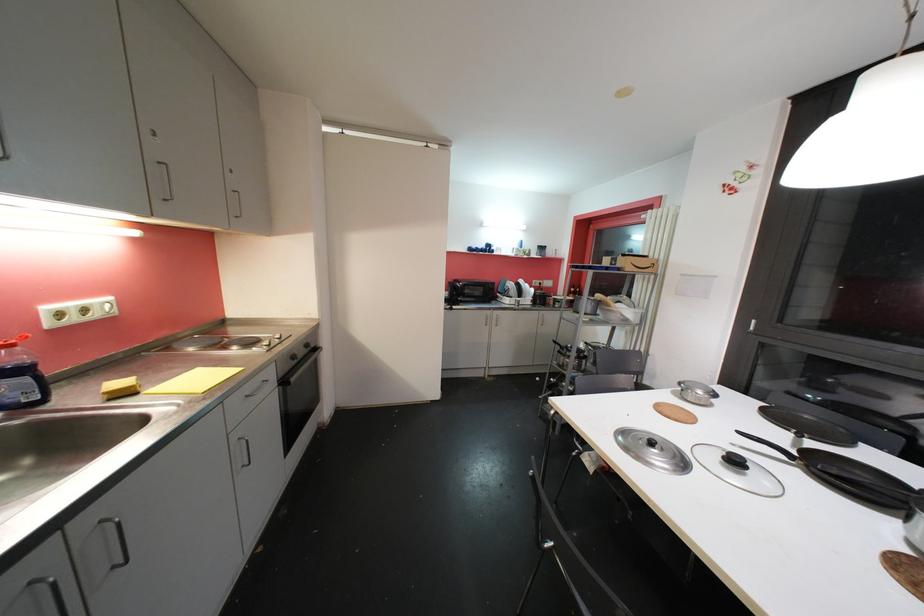
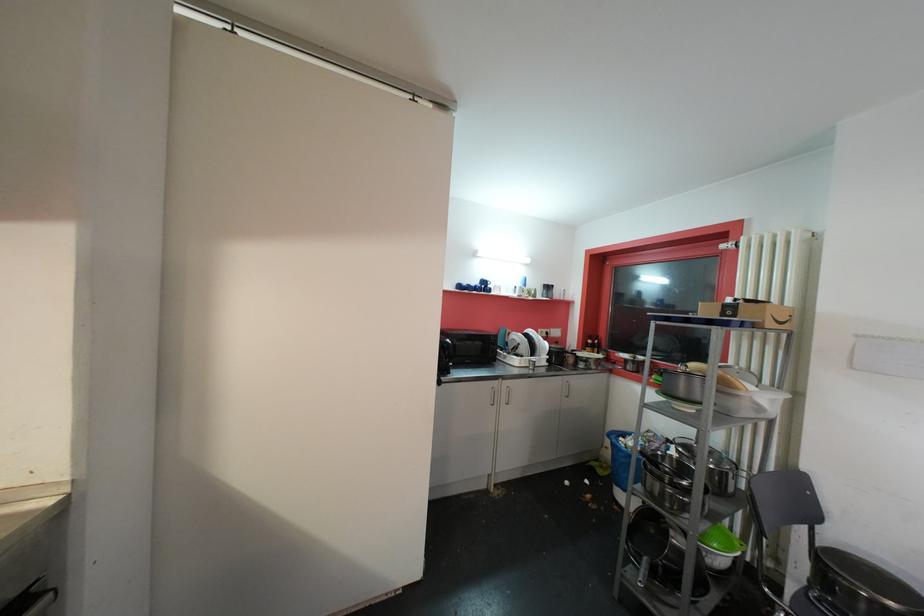
Question: What movement of the cameraman would produce the second image?

Choices:
 (A) Left
 (B) Right
 (C) Forward
 (D) Backward

Answer: (C)